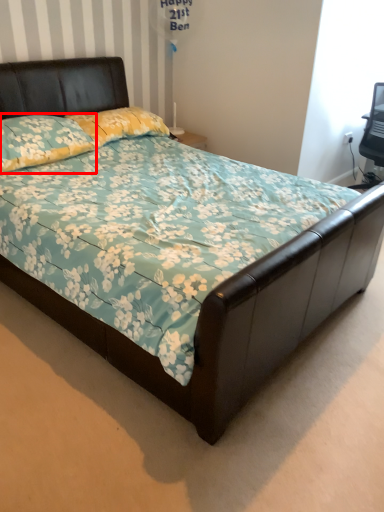
Question: In this image, where is pillow (annotated by the red box) located relative to pillow?

Choices:
 (A) right
 (B) left

Answer: (B)